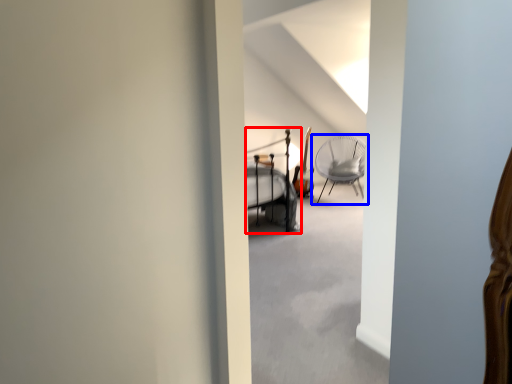
Question: Which object appears closest to the camera in this image, bunk bed (highlighted by a red box) or chair (highlighted by a blue box)?

Choices:
 (A) bunk bed
 (B) chair

Answer: (A)